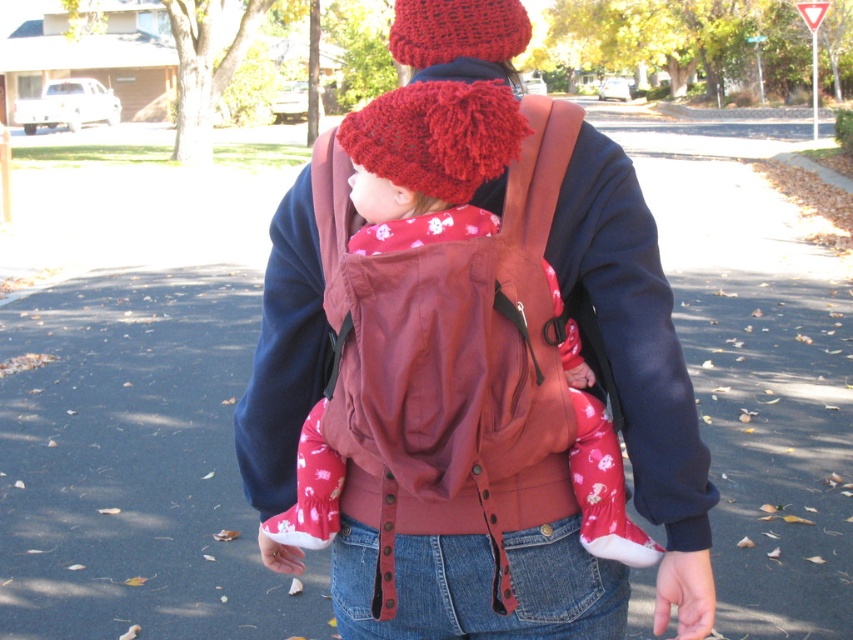
Measure the distance between matte brown baby carrier at center and red knitted hat at center.

matte brown baby carrier at center and red knitted hat at center are 12.36 inches apart from each other.

Is point (506, 198) positioned before point (345, 129)?

No, it is not.

Is point (418, 332) more distant than point (457, 200)?

No, (418, 332) is closer to viewer.

Where is `matte brown baby carrier at center`? matte brown baby carrier at center is located at coordinates (454, 348).

Which is below, red knitted hat at center or knitted woolen hat at upper center?

red knitted hat at center

Between red knitted hat at center and knitted woolen hat at upper center, which one appears on the left side from the viewer's perspective?

Positioned to the left is knitted woolen hat at upper center.

Locate an element on the screen. The height and width of the screenshot is (640, 853). red knitted hat at center is located at coordinates (437, 134).

Where is `red knitted hat at center`? Image resolution: width=853 pixels, height=640 pixels. red knitted hat at center is located at coordinates (437, 134).

How much distance is there between matte brown baby carrier at center and knitted woolen hat at upper center?

matte brown baby carrier at center is 22.68 inches away from knitted woolen hat at upper center.

Is matte brown baby carrier at center taller than knitted woolen hat at upper center?

Yes, matte brown baby carrier at center is taller than knitted woolen hat at upper center.

Who is more distant from viewer, (523, 435) or (480, 40)?

Point (480, 40)

Identify the location of matte brown baby carrier at center. (454, 348).